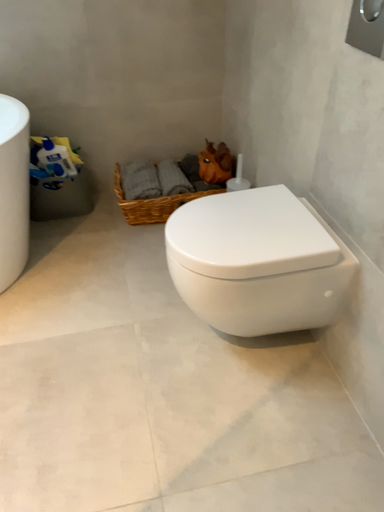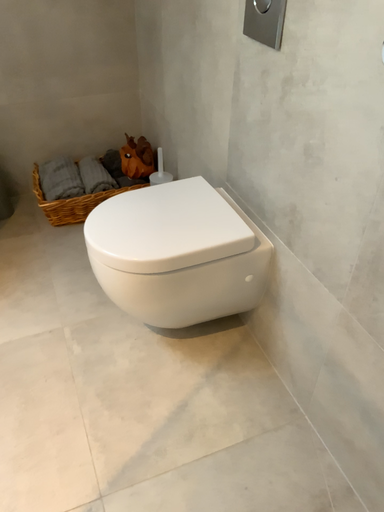
Question: How did the camera likely rotate when shooting the video?

Choices:
 (A) rotated right
 (B) rotated left

Answer: (A)